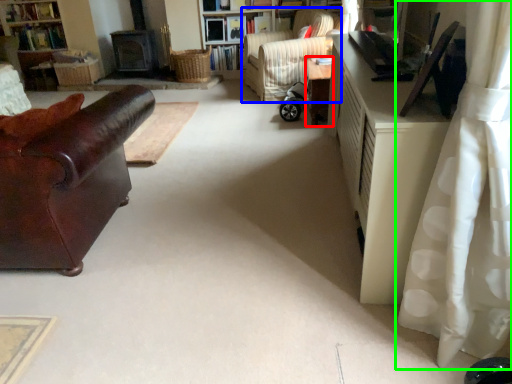
Question: Estimate the real-world distances between objects in this image. Which object is closer to table (highlighted by a red box), chair (highlighted by a blue box) or curtain (highlighted by a green box)?

Choices:
 (A) chair
 (B) curtain

Answer: (A)